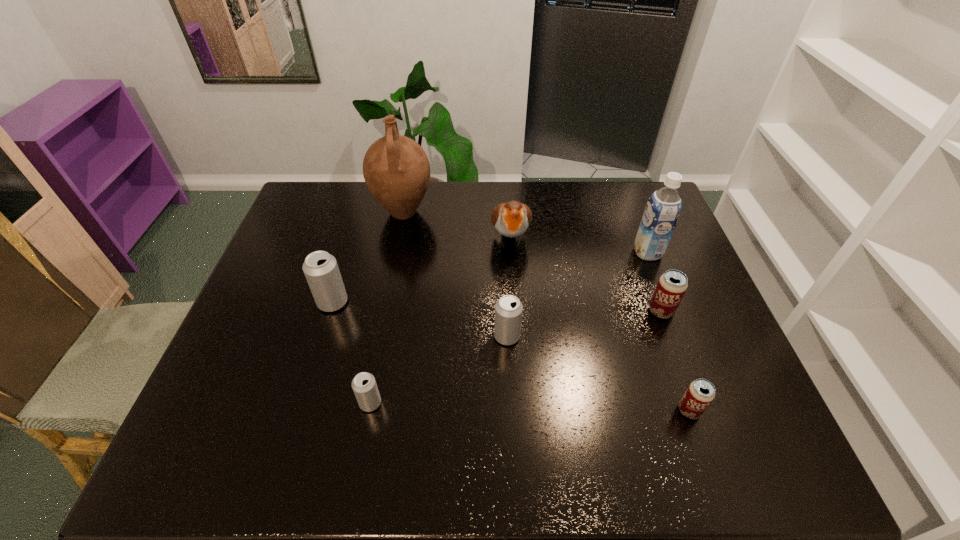
At what (x,y) coordinates should I click in order to perform the action: click on the fourth beer can from right to left. Please return your answer as a coordinate pair (x, y). Looking at the image, I should click on (364, 385).

The height and width of the screenshot is (540, 960). What are the coordinates of `the nearer red beer can` in the screenshot? It's located at (701, 392).

You are a GUI agent. You are given a task and a screenshot of the screen. Output one action in this format:
    pyautogui.click(x=<x>, y=<y>)
    Task: Click on the blank space located 0.100m on the right of the pitcher
    This screenshot has width=960, height=540.
    Given the screenshot: What is the action you would take?
    point(464,212)

The image size is (960, 540). Find the location of `vacant point located on the label of the soya milk`. vacant point located on the label of the soya milk is located at coordinates (579, 253).

Identify the location of free region located on the label of the soya milk. The width and height of the screenshot is (960, 540). (605, 253).

In order to click on free point located 0.170m on the label of the soya milk in this screenshot , I will do `click(579, 253)`.

The height and width of the screenshot is (540, 960). Identify the location of free space located 0.340m at the face of the brown bird. (518, 359).

Locate an element on the screen. The width and height of the screenshot is (960, 540). vacant space situated 0.380m on the front of the biggest white beer can is located at coordinates (286, 455).

Find the location of a particular element. The image size is (960, 540). vacant space situated 0.150m on the left of the bigger red beer can is located at coordinates (592, 312).

Image resolution: width=960 pixels, height=540 pixels. In order to click on blank area located 0.170m on the back of the sixth farthest object in this screenshot , I will do `click(504, 279)`.